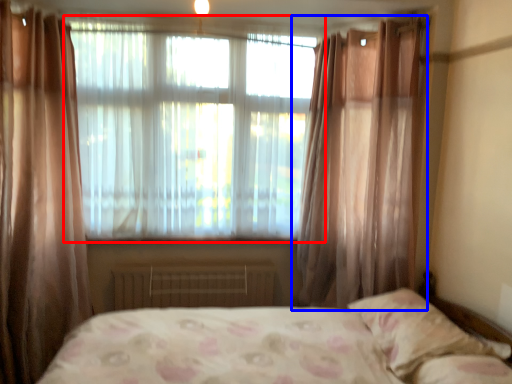
Question: Which object is further to the camera taking this photo, window (highlighted by a red box) or curtain (highlighted by a blue box)?

Choices:
 (A) window
 (B) curtain

Answer: (A)